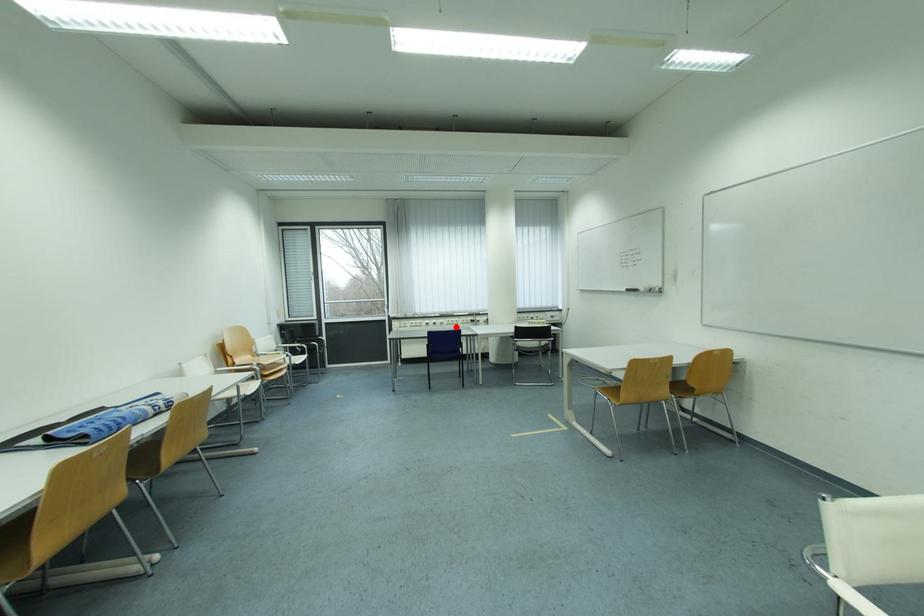
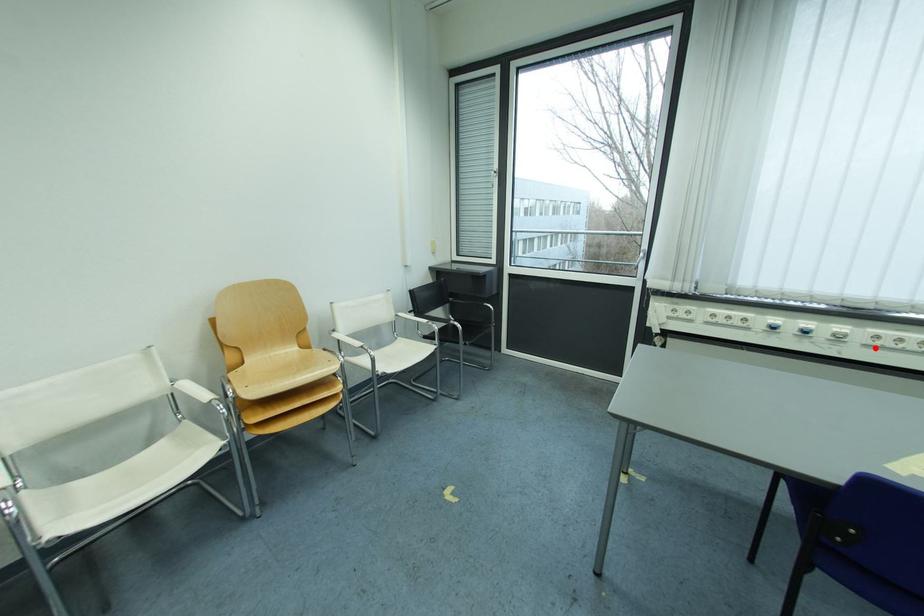
I am providing you with two images of the same scene from different viewpoints. A red point is marked on the first image and another point is marked on the second image. Are the points marked in image1 and image2 representing the same 3D position?

Yes